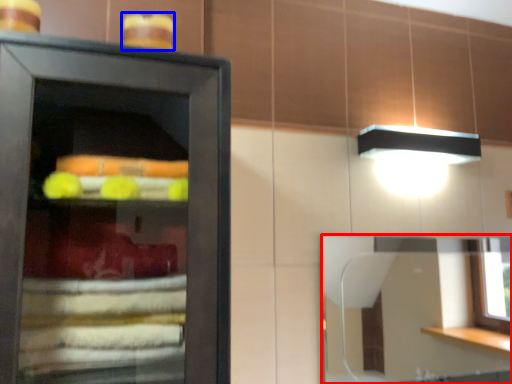
Question: Among these objects, which one is farthest to the camera, mirror (highlighted by a red box) or food (highlighted by a blue box)?

Choices:
 (A) mirror
 (B) food

Answer: (A)